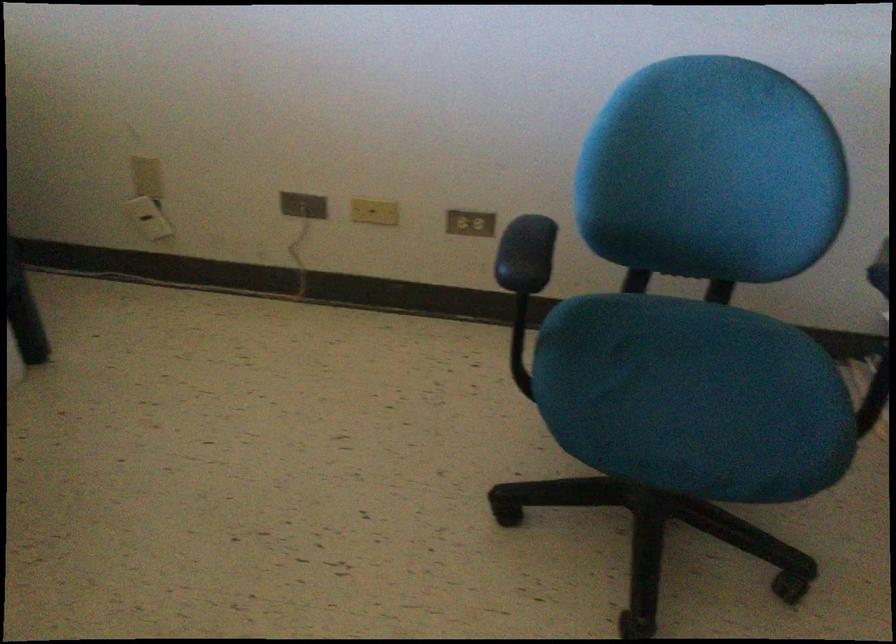
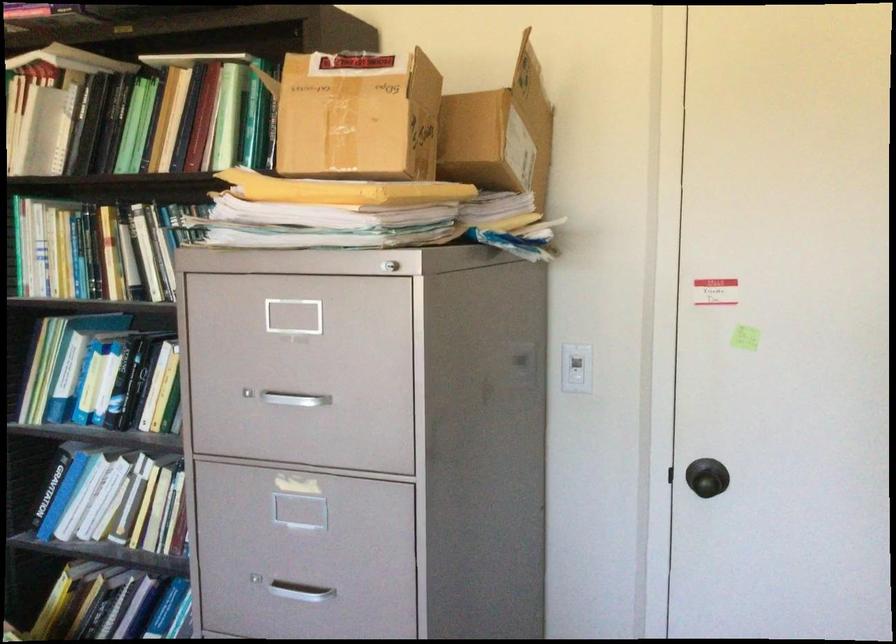
Question: Based on the continuous images, in which direction is the camera rotating? Reply with the corresponding letter.

Choices:
 (A) Left
 (B) Right
 (C) Up
 (D) Down

Answer: (B)